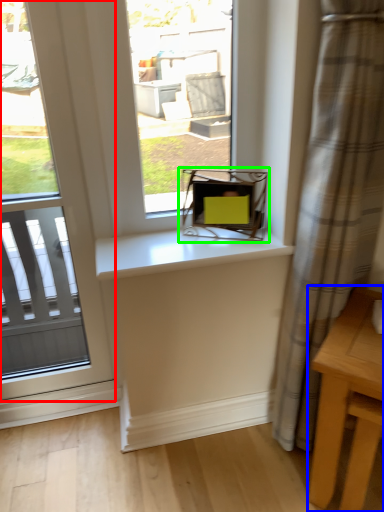
Question: Estimate the real-world distances between objects in this image. Which object is closer to window (highlighted by a red box), table (highlighted by a blue box) or chair (highlighted by a green box)?

Choices:
 (A) table
 (B) chair

Answer: (B)